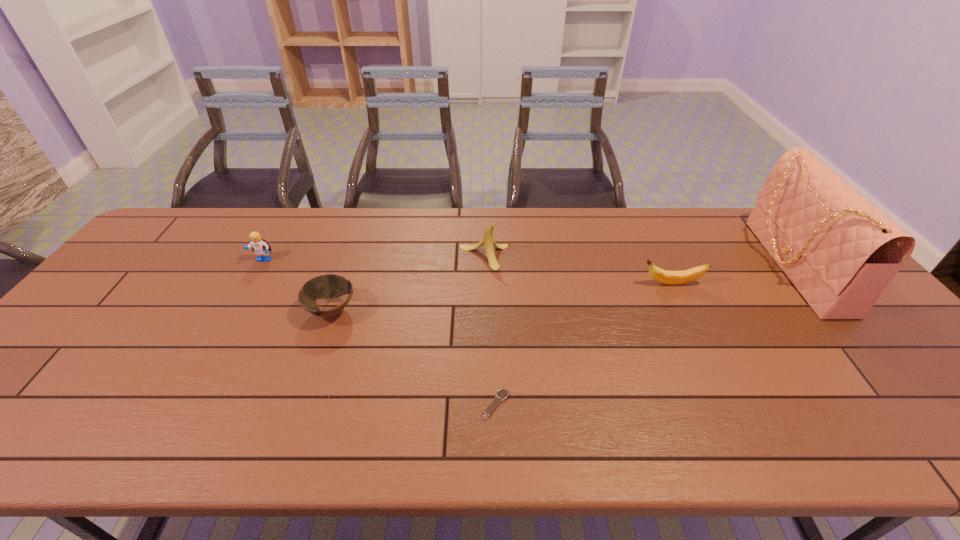
Find the location of a particular element. handbag is located at coordinates (840, 252).

At what (x,y) coordinates should I click in order to perform the action: click on the tallest object. Please return your answer as a coordinate pair (x, y). This screenshot has width=960, height=540. Looking at the image, I should click on (840, 252).

The height and width of the screenshot is (540, 960). What are the coordinates of `the fifth shortest object` in the screenshot? It's located at tap(488, 239).

At what (x,y) coordinates should I click in order to perform the action: click on the farther banana. Please return your answer as a coordinate pair (x, y). This screenshot has height=540, width=960. Looking at the image, I should click on (488, 239).

The width and height of the screenshot is (960, 540). What are the coordinates of `Lego` in the screenshot? It's located at (260, 247).

You are a GUI agent. You are given a task and a screenshot of the screen. Output one action in this format:
    pyautogui.click(x=<x>, y=<y>)
    Task: Click on the shorter banana
    
    Given the screenshot: What is the action you would take?
    pyautogui.click(x=663, y=276)

Find the location of a particular element. the nearer banana is located at coordinates (x=663, y=276).

Locate an element on the screen. bowl is located at coordinates (328, 286).

Find the location of a particular element. The height and width of the screenshot is (540, 960). the second shortest object is located at coordinates (328, 286).

At what (x,y) coordinates should I click in order to perform the action: click on the shortest object. Please return your answer as a coordinate pair (x, y). The height and width of the screenshot is (540, 960). Looking at the image, I should click on (502, 394).